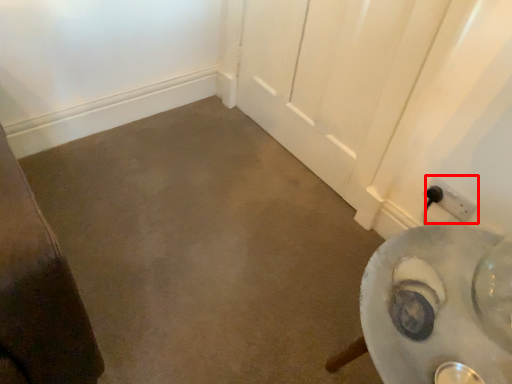
Question: From the image, what is the correct spatial relationship of power plugs and sockets (annotated by the red box) in relation to concrete?

Choices:
 (A) right
 (B) left

Answer: (A)